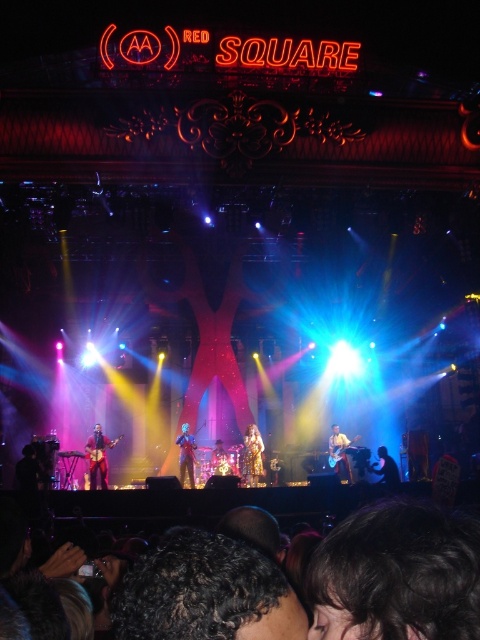
Between point (192, 477) and point (392, 481), which one is positioned behind?

Point (392, 481)

Which is more to the right, shiny blue suit at center or matte black guitar at center?

matte black guitar at center

What do you see at coordinates (186, 456) in the screenshot? I see `shiny blue suit at center` at bounding box center [186, 456].

Identify the location of shiny blue suit at center. (186, 456).

Between matte black guitar at lower left and matte black guitar at center, which one appears on the right side from the viewer's perspective?

matte black guitar at center is more to the right.

Who is more distant from viewer, (103, 458) or (376, 468)?

Positioned behind is point (376, 468).

I want to click on matte black guitar at lower left, so click(x=97, y=456).

Identify the location of matte black guitar at lower left. (97, 456).

Can you confirm if matte black guitar at lower left is taller than shiny blue suit at center?

Indeed, matte black guitar at lower left has a greater height compared to shiny blue suit at center.

Can you confirm if matte black guitar at lower left is shorter than shiny blue suit at center?

No, matte black guitar at lower left is not shorter than shiny blue suit at center.

Between point (111, 444) and point (193, 449), which one is positioned in front?

Positioned in front is point (193, 449).

This screenshot has width=480, height=640. Identify the location of matte black guitar at lower left. (97, 456).